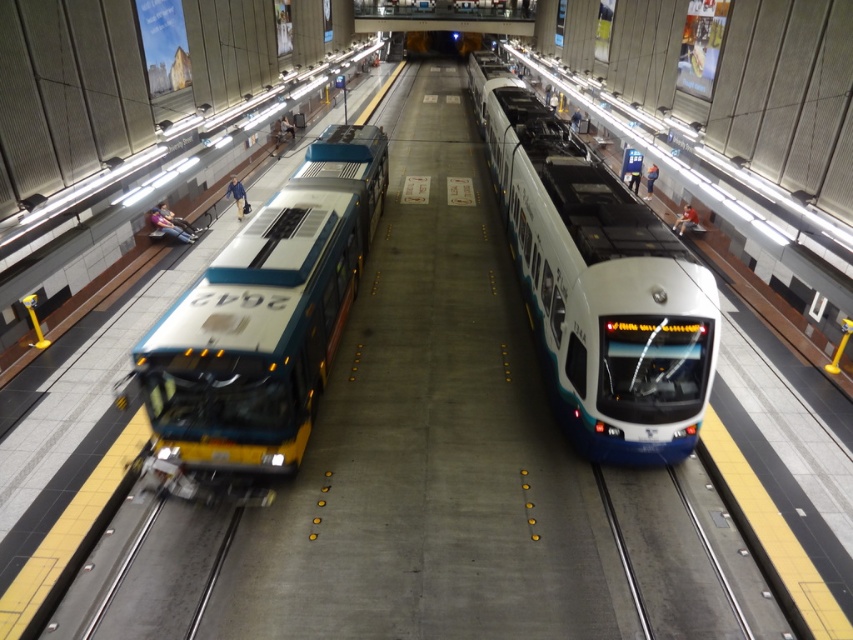
Question: Which of the following is the closest to the observer?

Choices:
 (A) (680, 365)
 (B) (258, 291)

Answer: (A)

Question: Can you confirm if white glossy train at center is positioned to the left of teal glossy bus at left?

Choices:
 (A) yes
 (B) no

Answer: (B)

Question: Is white glossy train at center positioned in front of teal glossy bus at left?

Choices:
 (A) no
 (B) yes

Answer: (A)

Question: Which point is closer to the camera?

Choices:
 (A) white glossy train at center
 (B) teal glossy bus at left

Answer: (B)

Question: Which point is closer to the camera?

Choices:
 (A) white glossy train at center
 (B) teal glossy bus at left

Answer: (B)

Question: Does white glossy train at center appear under teal glossy bus at left?

Choices:
 (A) yes
 (B) no

Answer: (B)